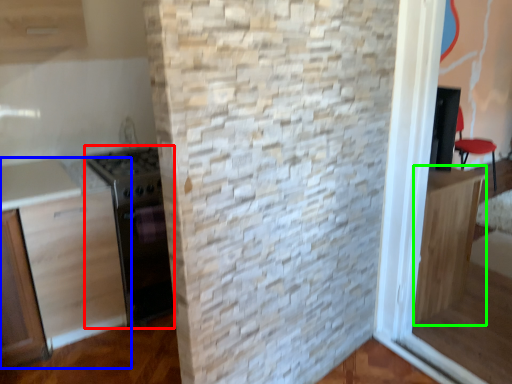
Question: Based on their relative distances, which object is farther from appliance (highlighted by a red box)? Choose from cabinetry (highlighted by a blue box) and cabinetry (highlighted by a green box).

Choices:
 (A) cabinetry
 (B) cabinetry

Answer: (B)